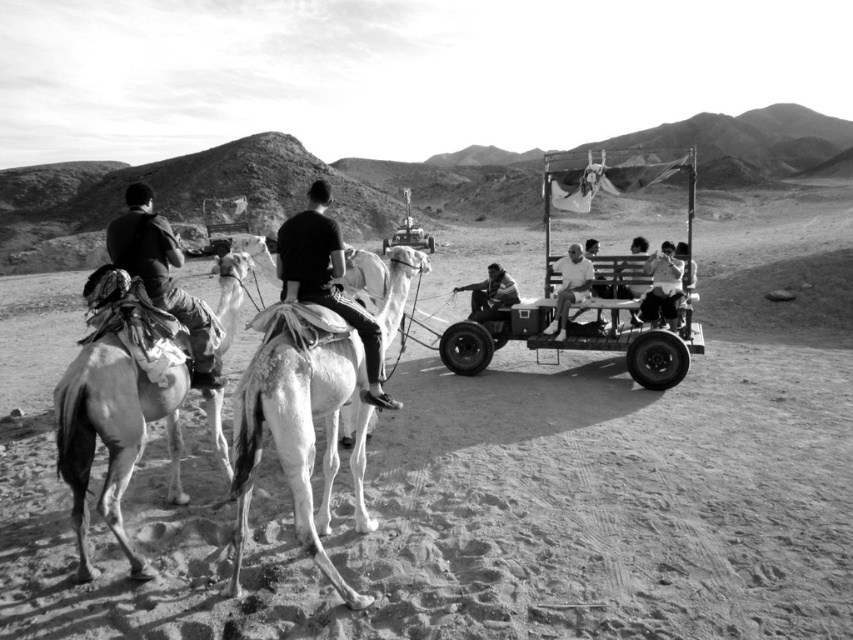
Is point (229, 289) in front of point (218, 368)?

No.

Does light brown textured camel at left have a greater width compared to dark fabric jacket at left?

Incorrect, light brown textured camel at left's width does not surpass dark fabric jacket at left's.

Which is behind, point (90, 454) or point (125, 211)?

Positioned behind is point (125, 211).

This screenshot has width=853, height=640. What are the coordinates of `light brown textured camel at left` in the screenshot? It's located at (113, 435).

Which is below, white matte camel at center or dark gray fabric camel at center?

white matte camel at center is lower down.

Is white matte camel at center taller than dark gray fabric camel at center?

No.

Between point (276, 353) and point (299, 296), which one is positioned in front?

Positioned in front is point (276, 353).

The height and width of the screenshot is (640, 853). I want to click on white matte camel at center, so pyautogui.click(x=294, y=435).

Which of these two, light brown textured camel at left or smooth leather jacket at center, stands taller?

light brown textured camel at left

Is point (85, 387) positioned in front of point (489, 284)?

Yes, point (85, 387) is closer to viewer.

Where is `light brown textured camel at left`? light brown textured camel at left is located at coordinates coord(113,435).